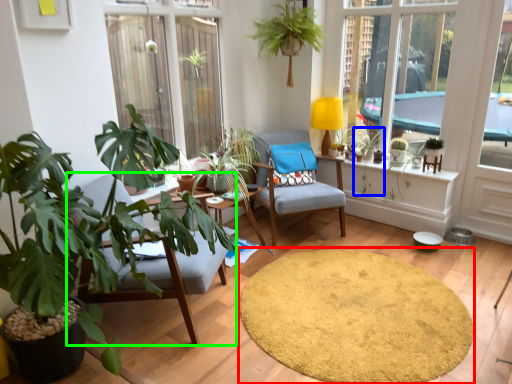
Question: Which is farther away from mat (highlighted by a red box)? plant (highlighted by a blue box) or chair (highlighted by a green box)?

Choices:
 (A) plant
 (B) chair

Answer: (A)